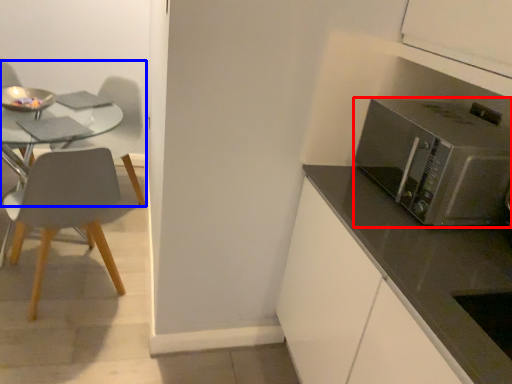
Question: Which object appears farthest to the camera in this image, microwave oven (highlighted by a red box) or chair (highlighted by a blue box)?

Choices:
 (A) microwave oven
 (B) chair

Answer: (B)